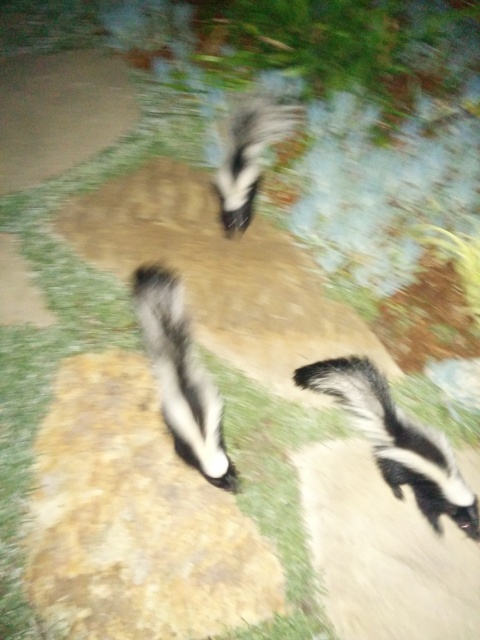
Question: From the image, what is the correct spatial relationship of black and white fur skunk at center in relation to black and white fur skunk at upper center?

Choices:
 (A) above
 (B) below

Answer: (B)

Question: Which point appears closest to the camera in this image?

Choices:
 (A) (197, 440)
 (B) (471, 515)
 (C) (224, 163)

Answer: (A)

Question: Among these objects, which one is farthest from the camera?

Choices:
 (A) black and white fur skunk at center
 (B) black and white fur skunk at lower right

Answer: (B)

Question: Does black and white fur skunk at lower right appear on the left side of black and white fur skunk at center?

Choices:
 (A) no
 (B) yes

Answer: (A)

Question: Among these points, which one is nearest to the camera?

Choices:
 (A) (215, 401)
 (B) (262, 173)
 (C) (363, 413)

Answer: (A)

Question: Does black and white fur skunk at center appear over black and white fur skunk at upper center?

Choices:
 (A) yes
 (B) no

Answer: (B)